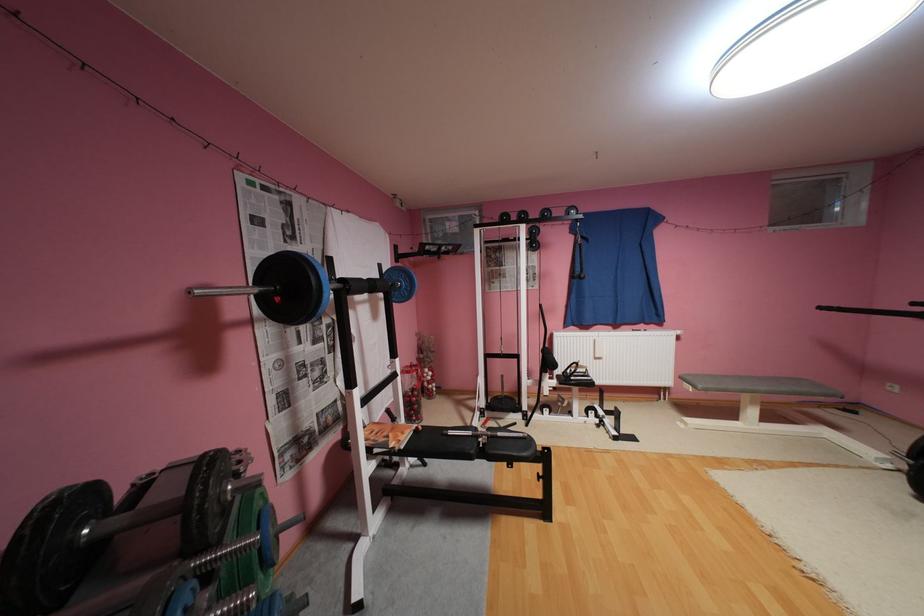
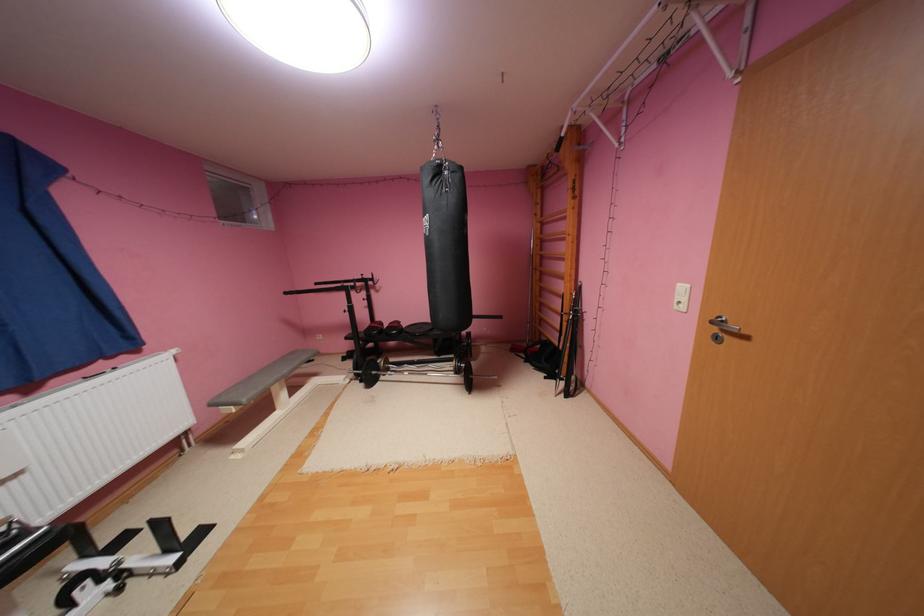
In the second image, find the point that corresponds to (x=604, y=359) in the first image.

(11, 483)